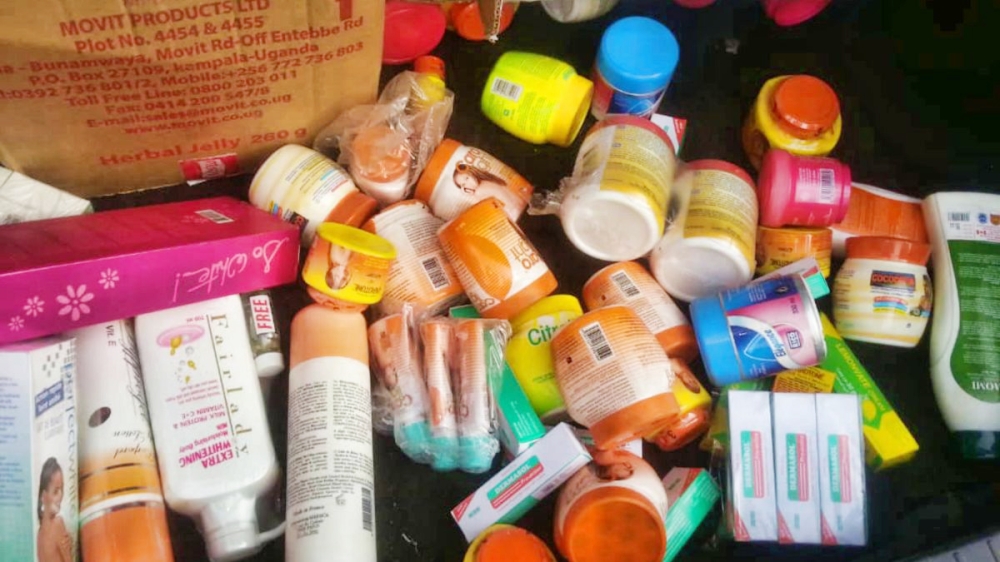
The height and width of the screenshot is (562, 1000). Identify the location of bottles. (102, 445), (196, 410), (411, 384), (443, 392), (481, 386), (970, 310), (429, 71).